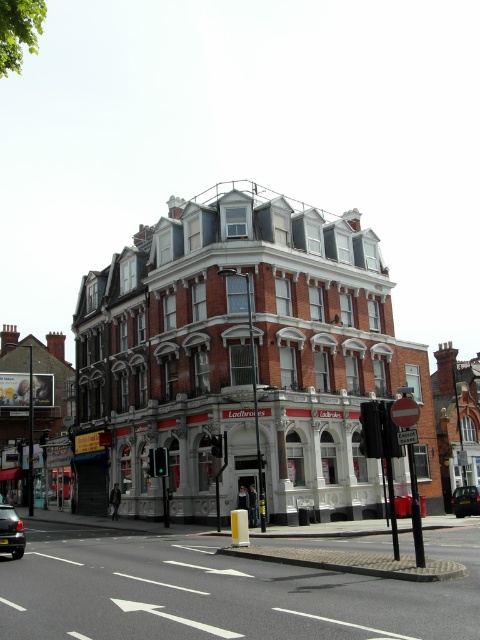
Question: Is black glossy car at center thinner than black metallic car at center?

Choices:
 (A) yes
 (B) no

Answer: (A)

Question: Does black asphalt road at center appear on the right side of black metallic car at center?

Choices:
 (A) yes
 (B) no

Answer: (B)

Question: Among these objects, which one is nearest to the camera?

Choices:
 (A) black asphalt road at center
 (B) black glossy car at center

Answer: (A)

Question: Can you confirm if black glossy car at center is positioned below black metallic car at center?

Choices:
 (A) yes
 (B) no

Answer: (B)

Question: Which point is farther to the camera?

Choices:
 (A) black glossy car at center
 (B) black asphalt road at center

Answer: (A)

Question: Which object is closer to the camera taking this photo?

Choices:
 (A) black metallic car at center
 (B) black asphalt road at center

Answer: (B)